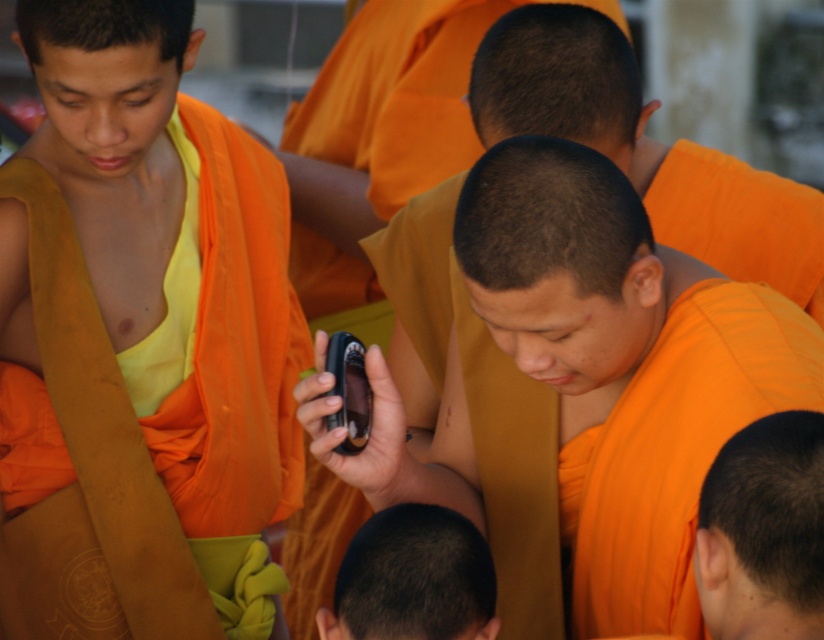
Is matte orange robe at left to the right of dark brown hair at center from the viewer's perspective?

Incorrect, matte orange robe at left is not on the right side of dark brown hair at center.

Is matte orange robe at left closer to the viewer compared to dark brown hair at center?

No, matte orange robe at left is behind dark brown hair at center.

The image size is (824, 640). What do you see at coordinates (139, 342) in the screenshot?
I see `matte orange robe at left` at bounding box center [139, 342].

You are a GUI agent. You are given a task and a screenshot of the screen. Output one action in this format:
    pyautogui.click(x=<x>, y=<y>)
    Task: Click on the matte orange robe at left
    The image size is (824, 640).
    Given the screenshot: What is the action you would take?
    pyautogui.click(x=139, y=342)

Can you confirm if matte orange monk at center is smaller than shiny orange monk at center?

No.

Who is higher up, matte orange monk at center or shiny orange monk at center?

matte orange monk at center

Locate an element on the screen. Image resolution: width=824 pixels, height=640 pixels. matte orange monk at center is located at coordinates (579, 396).

Measure the distance from matte orange robe at left to shiny orange monk at center.

matte orange robe at left and shiny orange monk at center are 1.46 meters apart from each other.

This screenshot has height=640, width=824. What do you see at coordinates (139, 342) in the screenshot?
I see `matte orange robe at left` at bounding box center [139, 342].

Find the location of `matte orange robe at left`. matte orange robe at left is located at coordinates (139, 342).